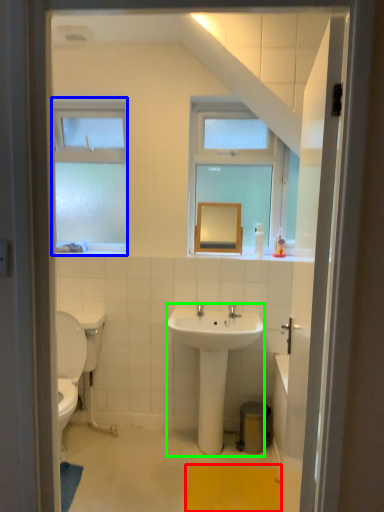
Question: Based on their relative distances, which object is farther from bath mat (highlighted by a red box)? Choose from window (highlighted by a blue box) and sink (highlighted by a green box).

Choices:
 (A) window
 (B) sink

Answer: (A)